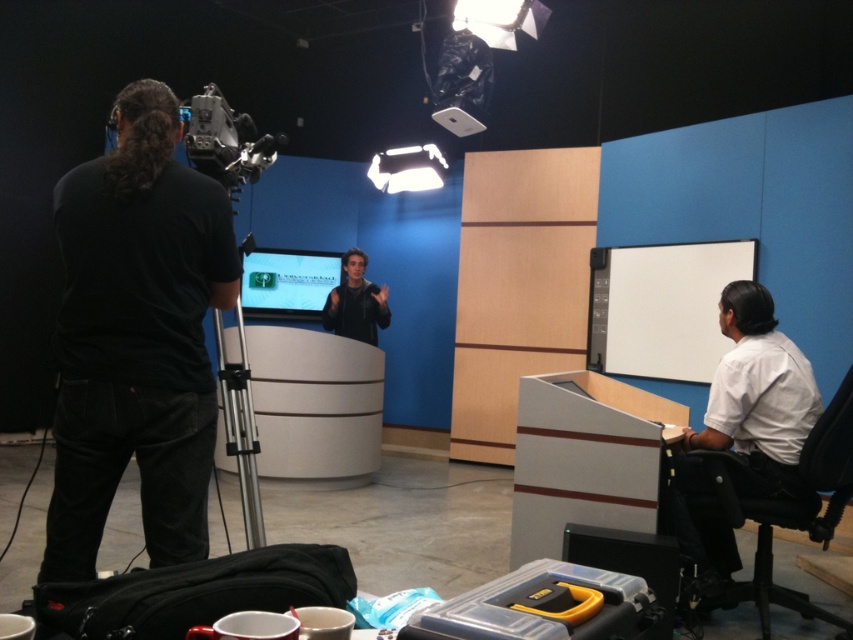
Question: Which object is farther from the camera taking this photo?

Choices:
 (A) matte green screen at center
 (B) silver metallic tripod at left
 (C) matte black video camera at upper left

Answer: (A)

Question: Is black leather chair at lower right below matte black video camera at upper left?

Choices:
 (A) yes
 (B) no

Answer: (A)

Question: Is white matte projection screen at right bigger than matte green screen at center?

Choices:
 (A) yes
 (B) no

Answer: (A)

Question: Which of these objects is positioned farthest from the matte green screen at center?

Choices:
 (A) white plastic projector at upper center
 (B) black matte jacket at center
 (C) silver metallic tripod at left

Answer: (C)

Question: Which point appears closest to the camera in this image?

Choices:
 (A) (354, 321)
 (B) (247, 397)
 (C) (224, 115)
 (D) (280, 273)

Answer: (C)

Question: Can you confirm if white matte projection screen at right is bigger than black matte jacket at center?

Choices:
 (A) no
 (B) yes

Answer: (B)